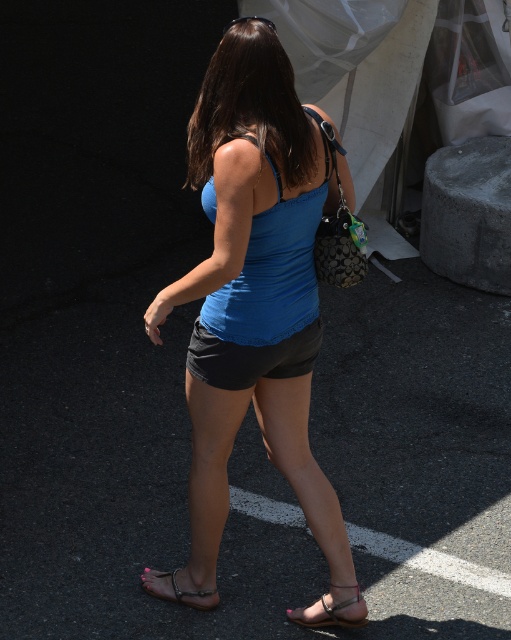
Which is behind, point (246, 112) or point (305, 317)?

Point (305, 317)

Does shiny brown hair at center appear under matte blue tank top at center?

Actually, shiny brown hair at center is above matte blue tank top at center.

Does point (254, 83) come in front of point (311, 218)?

Yes, point (254, 83) is in front of point (311, 218).

You are a GUI agent. You are given a task and a screenshot of the screen. Output one action in this format:
    pyautogui.click(x=<x>, y=<y>)
    Task: Click on the shiny brown hair at center
    The width and height of the screenshot is (511, 640).
    Given the screenshot: What is the action you would take?
    [250, 104]

Which of these two, blue matte tank top at center or matte blue tank top at center, stands taller?

blue matte tank top at center

Which is more to the left, blue matte tank top at center or matte blue tank top at center?

blue matte tank top at center

The width and height of the screenshot is (511, 640). What are the coordinates of `blue matte tank top at center` in the screenshot? It's located at pyautogui.click(x=254, y=291).

Image resolution: width=511 pixels, height=640 pixels. In order to click on blue matte tank top at center in this screenshot , I will do `click(254, 291)`.

Can you confirm if shiny brown hair at center is positioned to the left of brown leather sandal at lower center?

In fact, shiny brown hair at center is to the right of brown leather sandal at lower center.

Which is above, shiny brown hair at center or brown leather sandal at lower center?

shiny brown hair at center is above.

The width and height of the screenshot is (511, 640). Describe the element at coordinates (250, 104) in the screenshot. I see `shiny brown hair at center` at that location.

At what (x,y) coordinates should I click in order to perform the action: click on shiny brown hair at center. Please return your answer as a coordinate pair (x, y). This screenshot has width=511, height=640. Looking at the image, I should click on (250, 104).